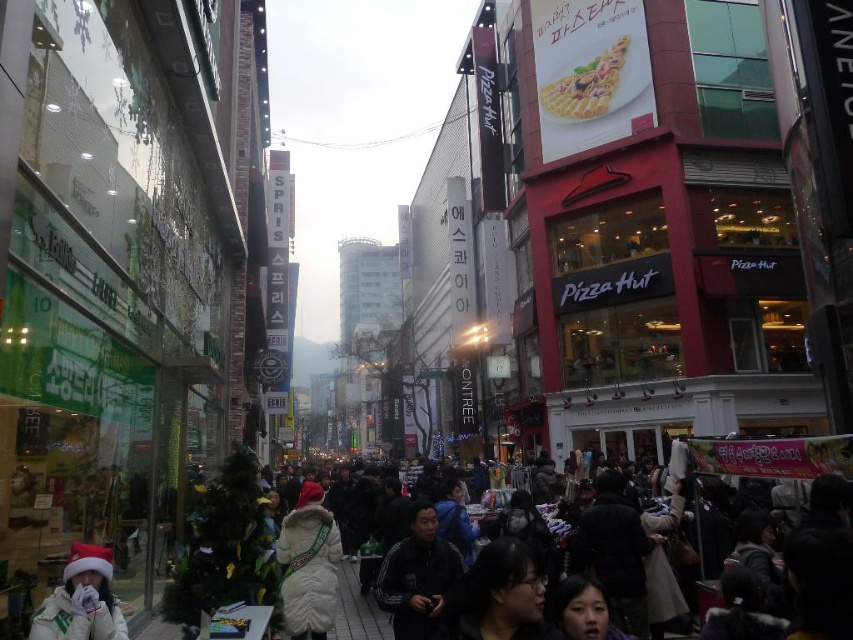
Question: Is matte black glasses at lower center bigger than dark gray jacket at center?

Choices:
 (A) yes
 (B) no

Answer: (B)

Question: Can you confirm if matte black glasses at lower center is thinner than white fur coat at center?

Choices:
 (A) no
 (B) yes

Answer: (B)

Question: Which point appears farthest from the camera in this image?

Choices:
 (A) (462, 586)
 (B) (61, 600)

Answer: (B)

Question: Considering the real-world distances, which object is closest to the matte black glasses at lower center?

Choices:
 (A) white fleece jacket at lower left
 (B) dark gray jacket at center

Answer: (B)

Question: Which object appears closest to the camera in this image?

Choices:
 (A) matte black glasses at lower center
 (B) dark gray jacket at center

Answer: (A)

Question: Is the position of white fur coat at center more distant than that of white fleece jacket at lower left?

Choices:
 (A) yes
 (B) no

Answer: (A)